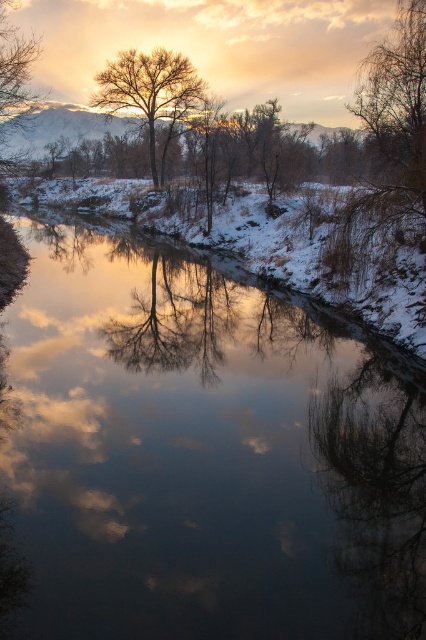
Question: From the image, what is the correct spatial relationship of smooth water at center in relation to bare branches at upper left?

Choices:
 (A) left
 (B) right

Answer: (B)

Question: Among these objects, which one is farthest from the camera?

Choices:
 (A) smooth water at center
 (B) transparent glass trees at center
 (C) bare branches at upper left

Answer: (C)

Question: Which object is closer to the camera taking this photo?

Choices:
 (A) bare branches tree at center
 (B) transparent glass trees at center
 (C) smooth water at center

Answer: (C)

Question: In this image, where is transparent glass trees at center located relative to bare branches at upper left?

Choices:
 (A) left
 (B) right

Answer: (B)

Question: Does bare branches tree at center have a smaller size compared to bare branches at upper left?

Choices:
 (A) yes
 (B) no

Answer: (A)

Question: Which point is farther to the camera?

Choices:
 (A) (20, 93)
 (B) (141, 58)
 (C) (146, 369)
 (D) (40, 300)

Answer: (B)